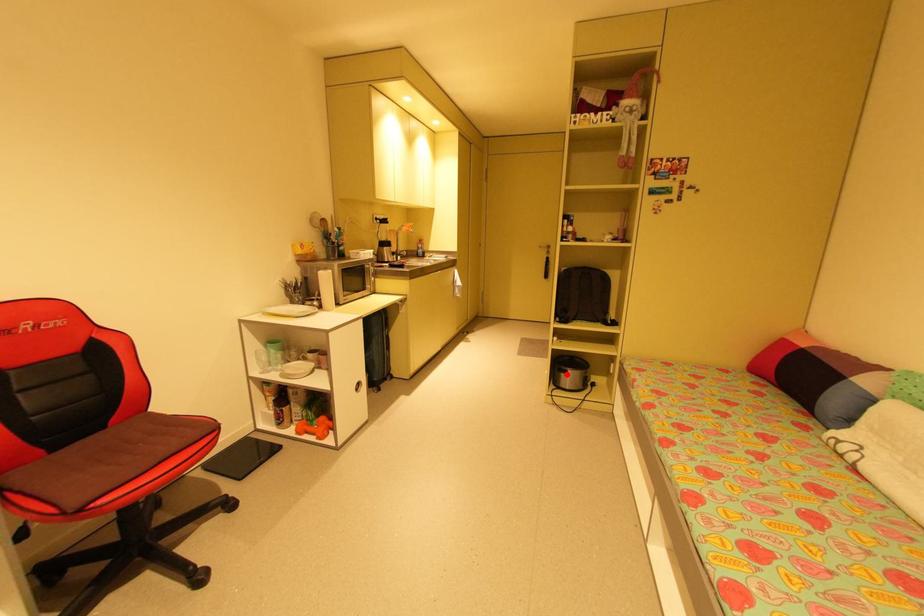
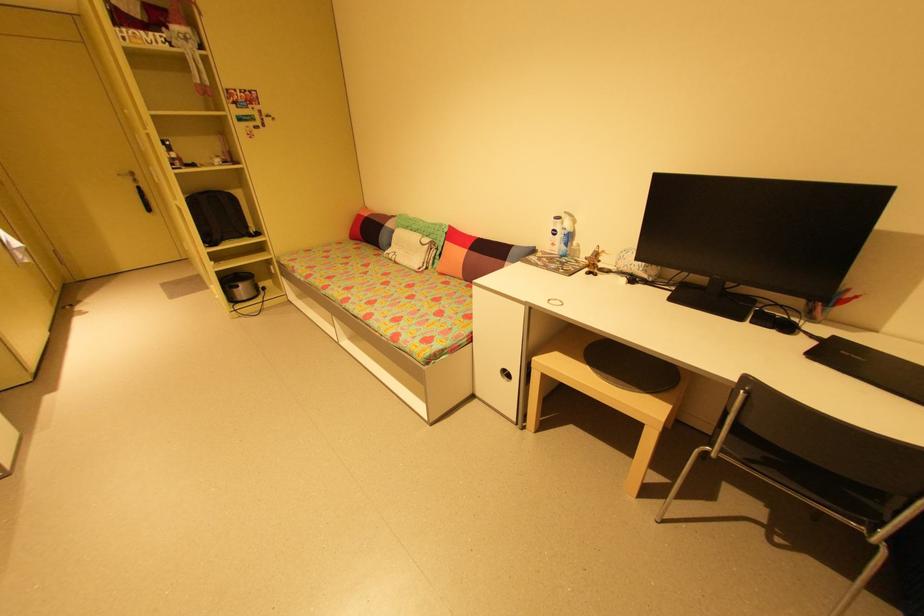
Locate, in the second image, the point that corresponds to the highlighted location in the first image.

(239, 291)